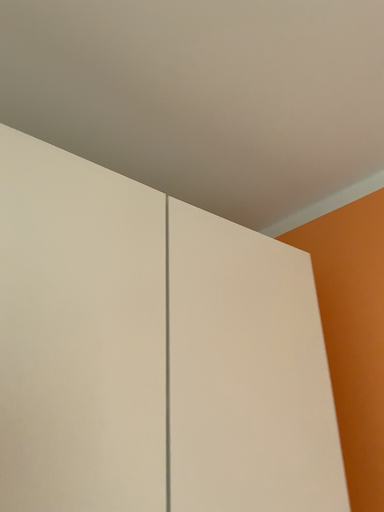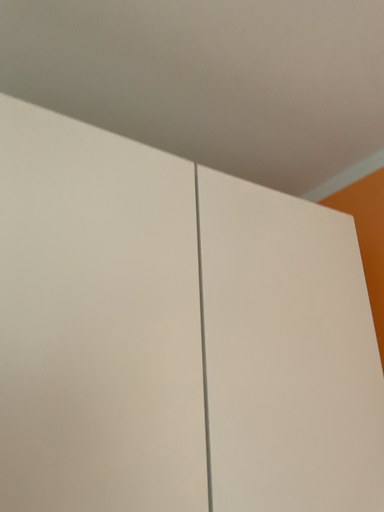
Question: Which way did the camera rotate in the video?

Choices:
 (A) rotated left
 (B) rotated right

Answer: (A)